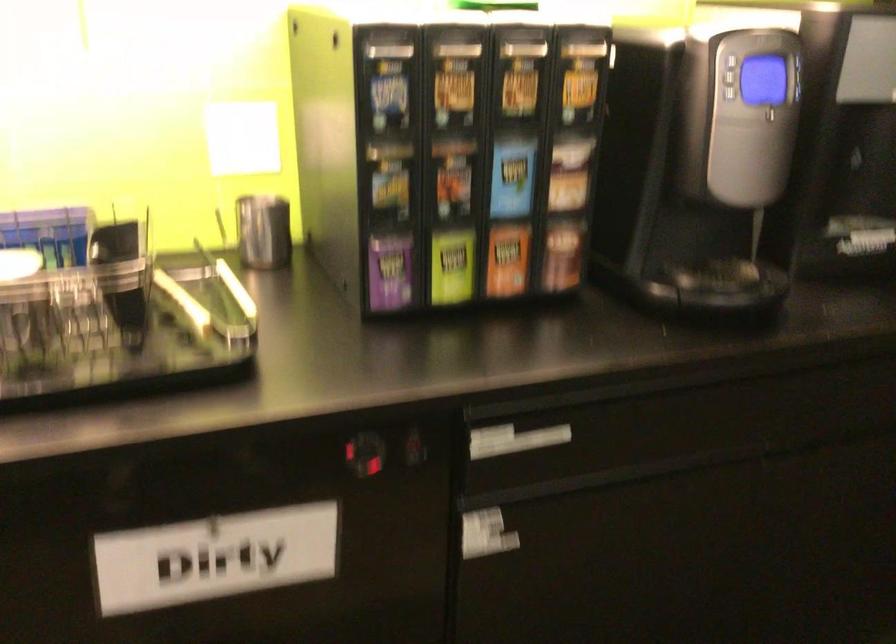
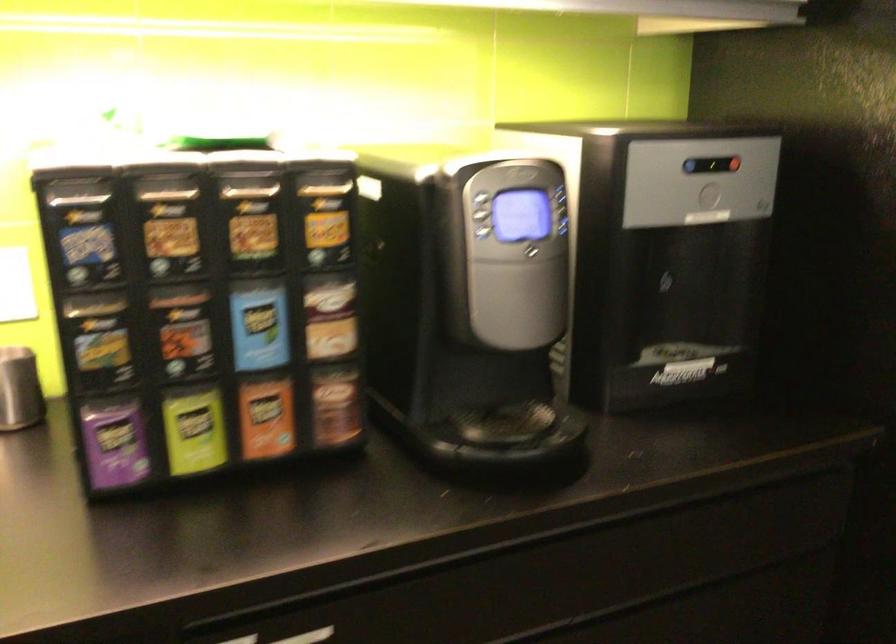
In the second image, find the point that corresponds to (273,227) in the first image.

(19, 389)